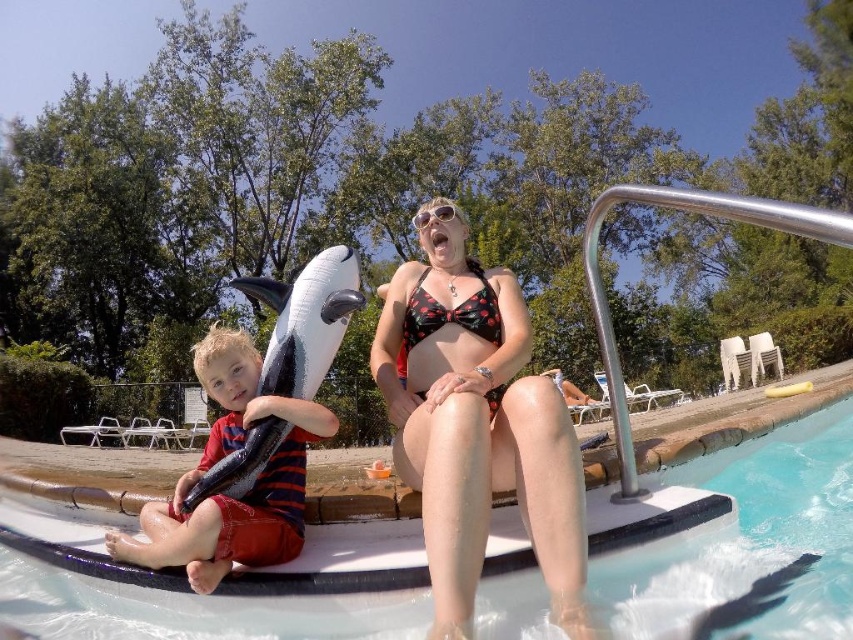
How far apart are white glossy water at lower center and striped cotton shirt at left?

They are 6.51 feet apart.

Between point (540, 600) and point (267, 477), which one is positioned in front?

Positioned in front is point (540, 600).

Who is more forward, (335, 636) or (225, 557)?

Point (335, 636) is in front.

Locate an element on the screen. The width and height of the screenshot is (853, 640). white glossy water at lower center is located at coordinates (741, 534).

Does black floral bikini at upper center appear on the right side of striped cotton shirt at left?

Indeed, black floral bikini at upper center is positioned on the right side of striped cotton shirt at left.

Which is more to the left, black floral bikini at upper center or striped cotton shirt at left?

Positioned to the left is striped cotton shirt at left.

In the scene shown: Who is more distant from viewer, (465, 321) or (247, 360)?

Point (465, 321)

Find the location of a particular element. black floral bikini at upper center is located at coordinates (476, 422).

Who is positioned more to the right, white glossy water at lower center or black floral bikini at upper center?

white glossy water at lower center

Can you confirm if white glossy water at lower center is wider than black floral bikini at upper center?

Correct, the width of white glossy water at lower center exceeds that of black floral bikini at upper center.

Locate an element on the screen. white glossy water at lower center is located at coordinates (741, 534).

This screenshot has height=640, width=853. I want to click on white glossy water at lower center, so click(x=741, y=534).